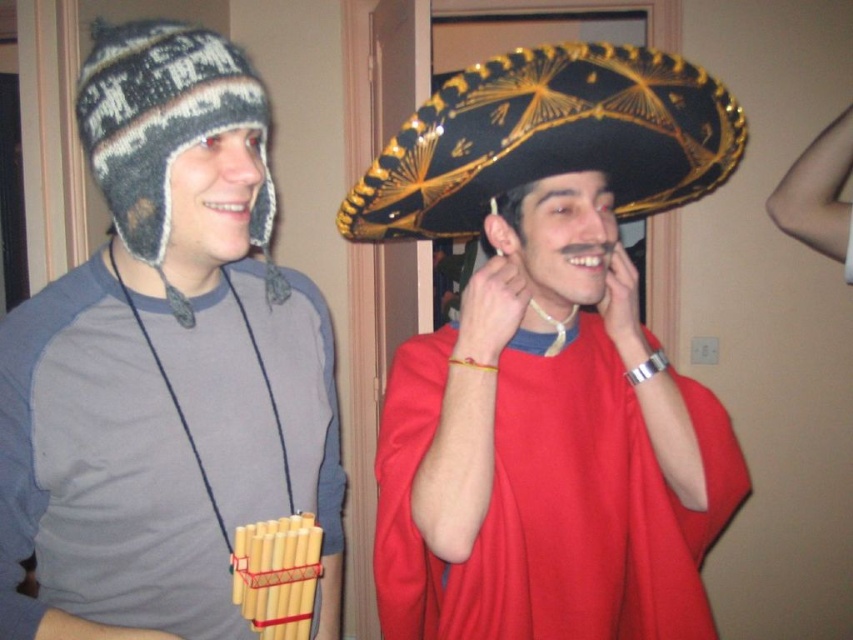
Is black felt sombrero at center thinner than knitted woolen beanie at left?

In fact, black felt sombrero at center might be wider than knitted woolen beanie at left.

What do you see at coordinates (549, 138) in the screenshot? I see `black felt sombrero at center` at bounding box center [549, 138].

Is point (433, 208) positioned behind point (140, 68)?

Yes, point (433, 208) is farther from viewer.

The image size is (853, 640). I want to click on black felt sombrero at center, so click(549, 138).

In the scene shown: Can you confirm if knitted wool beanie at left is positioned above knitted woolen beanie at left?

No, knitted wool beanie at left is not above knitted woolen beanie at left.

Does knitted wool beanie at left have a greater width compared to knitted woolen beanie at left?

Indeed, knitted wool beanie at left has a greater width compared to knitted woolen beanie at left.

You are a GUI agent. You are given a task and a screenshot of the screen. Output one action in this format:
    pyautogui.click(x=<x>, y=<y>)
    Task: Click on the knitted wool beanie at left
    
    Given the screenshot: What is the action you would take?
    pyautogui.click(x=164, y=364)

Between point (223, 490) and point (630, 120), which one is positioned behind?

Positioned behind is point (223, 490).

Who is taller, knitted wool beanie at left or black felt sombrero at center?

Standing taller between the two is knitted wool beanie at left.

Does point (303, 442) come in front of point (665, 77)?

No, it is behind (665, 77).

Locate an element on the screen. The height and width of the screenshot is (640, 853). knitted wool beanie at left is located at coordinates (164, 364).